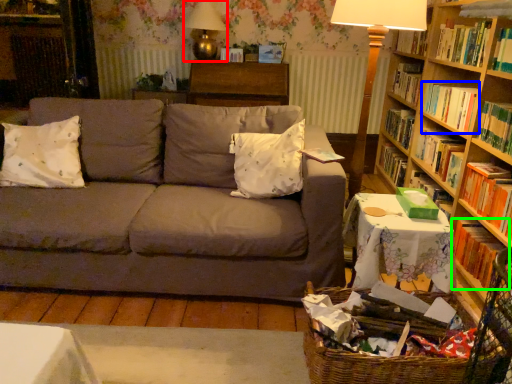
Question: Estimate the real-world distances between objects in this image. Which object is closer to table lamp (highlighted by a red box), book (highlighted by a blue box) or book (highlighted by a green box)?

Choices:
 (A) book
 (B) book

Answer: (A)